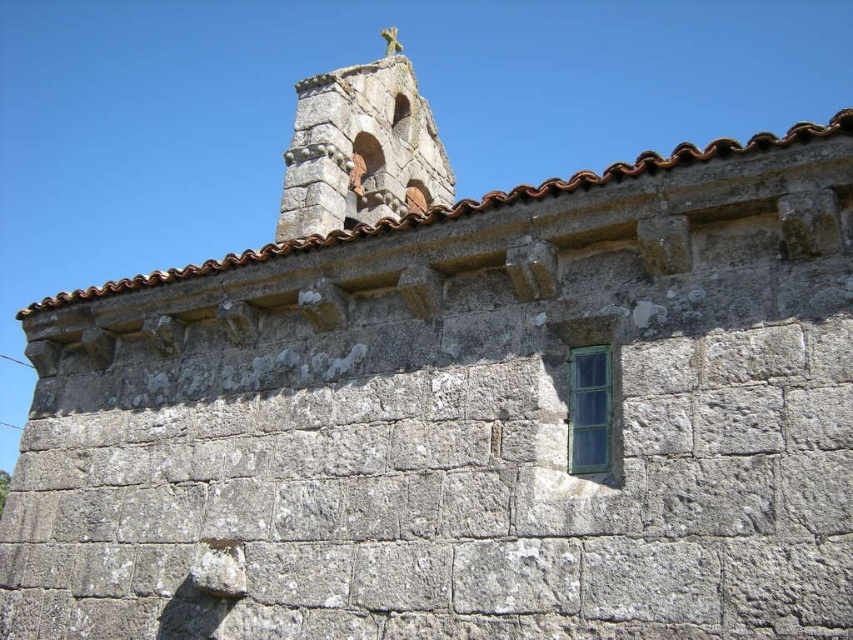
Looking at this image, you are standing in front of the stone building and want to locate both the stone cross at upper center and the green glass window at upper right. Which object is placed higher relative to the other?

The stone cross at upper center is positioned over the green glass window at upper right, meaning it is higher up.

In the scene shown: You are standing in front of the stone building and notice two features on its upper part. The stone cross at upper center and the green glass window at upper right. Which one is positioned to the left when viewed from the front?

The stone cross at upper center is positioned to the left of the green glass window at upper right.